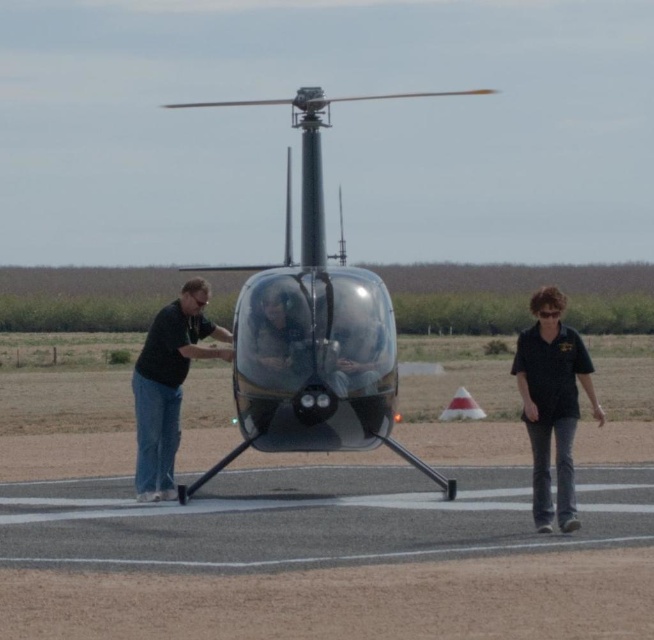
You are a photographer standing behind the two people near the helicopter. You want to take a photo that includes both the black matte shirt at center and the matte black shirt at left. Which person should you focus on first to ensure both are in frame?

You should focus on the black matte shirt at center first because it is positioned over the matte black shirt at left, meaning it is closer to you and will be in the foreground. By focusing on the closer subject, both will be in focus as the background subject will still be within the depth of field.

You are a pilot planning to land a helicopter on the smooth asphalt tarmac at center. The coordinates of the tarmac are given as point 0.872, 0.502. If your helicopter requires a landing zone with coordinates between 0.8 and 0.6 on the x and y axes respectively, will this tarmac be suitable?

The coordinates of the smooth asphalt tarmac at center are at point (328, 557). Since the required x coordinate range is between 0.8 and 0.6, and the tarmac is at 0.872 on the x axis, it falls within the required range. However, the y coordinate is 0.502, which is below the required minimum of 0.6. Therefore, the tarmac is not suitable for landing as it does not meet the y coordinate requirement.